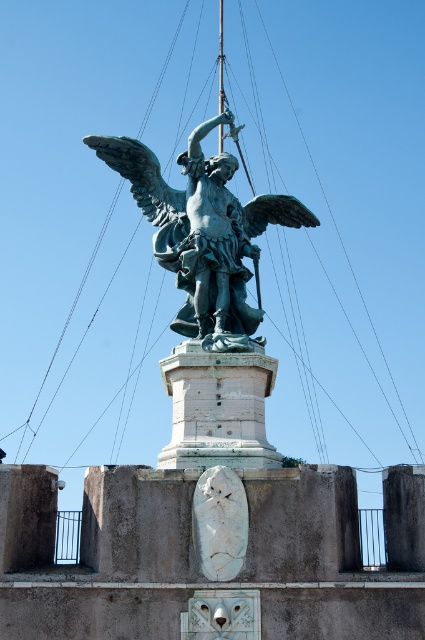
Question: Is green patina statue at center to the left of white stone pedestal at center from the viewer's perspective?

Choices:
 (A) yes
 (B) no

Answer: (A)

Question: Which of the following is the closest to the observer?

Choices:
 (A) (178, 321)
 (B) (181, 460)

Answer: (B)

Question: Can you confirm if green patina statue at center is wider than white stone pedestal at center?

Choices:
 (A) no
 (B) yes

Answer: (B)

Question: Among these objects, which one is nearest to the camera?

Choices:
 (A) green patina statue at center
 (B) white stone pedestal at center

Answer: (B)

Question: Is green patina statue at center in front of white stone pedestal at center?

Choices:
 (A) no
 (B) yes

Answer: (A)

Question: Which object is farther from the camera taking this photo?

Choices:
 (A) green patina statue at center
 (B) white stone pedestal at center

Answer: (A)